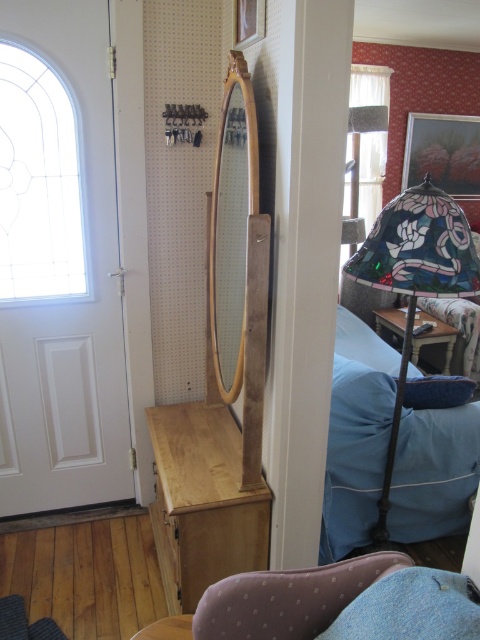
Consider the image. You are arranging a small table in the room and want to place a decorative item between the stained glass lampshade at right and the blue fabric pillow at lower right. Which object should be placed to the left of the other to maintain the current layout?

The stained glass lampshade at right should be placed to the left of the blue fabric pillow at lower right to maintain the current layout, as it is already positioned to the left of the pillow.

You are standing in the room and want to pick up the stained glass lampshade at right and the blue fabric pillow at right. Which object should you reach for first if you want to grab the one closer to you?

The stained glass lampshade at right is closer to the viewer than the blue fabric pillow at right, so you should reach for the stained glass lampshade at right first.